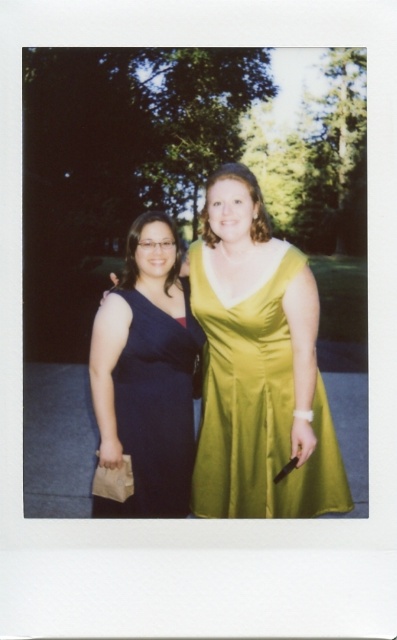
Can you confirm if satin yellow dress at center is bigger than matte blue dress at left?

Correct, satin yellow dress at center is larger in size than matte blue dress at left.

Which is behind, point (321, 426) or point (198, 326)?

Point (198, 326)

Locate an element on the screen. This screenshot has width=397, height=640. satin yellow dress at center is located at coordinates (256, 408).